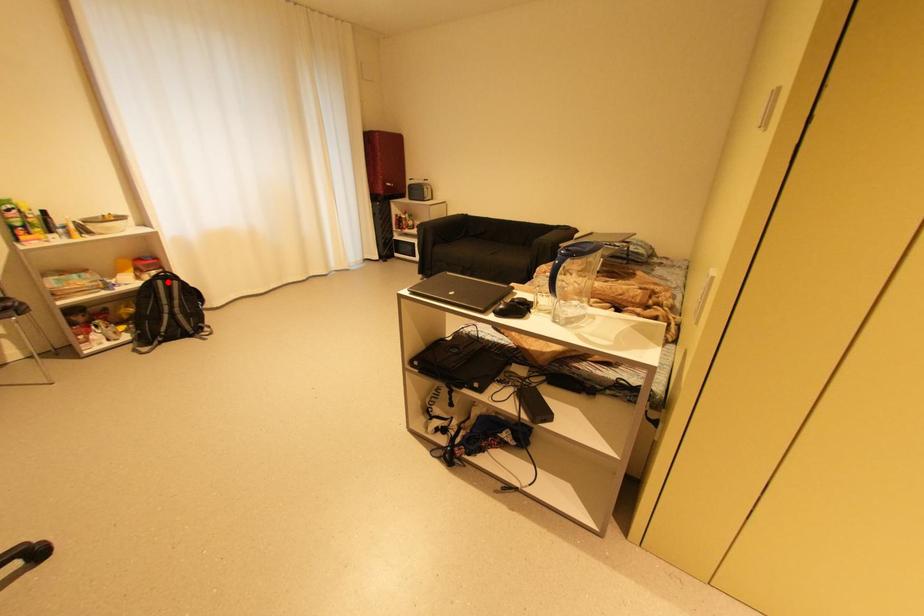
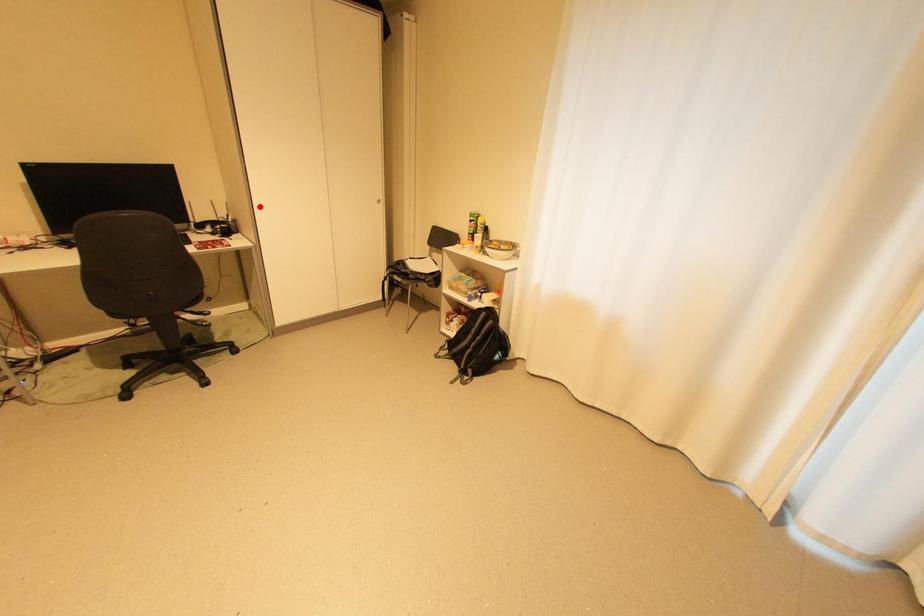
Based on the photo, I am providing you with two images of the same scene from different viewpoints. A red point is marked on the first image and another point is marked on the second image. Is the red point in image1 aligned with the point shown in image2?

No